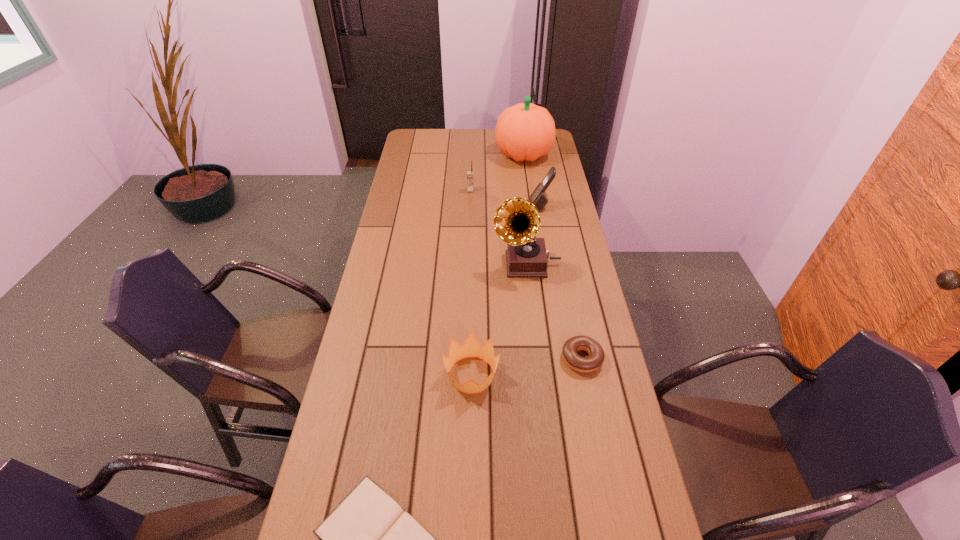
At what (x,y) coordinates should I click in order to perform the action: click on free space that is in between the taller cellular telephone and the crown. Please return your answer as a coordinate pair (x, y). The width and height of the screenshot is (960, 540). Looking at the image, I should click on (506, 291).

I want to click on vacant point located between the third farthest object and the doughnut, so click(561, 282).

I want to click on unoccupied area between the fifth tallest object and the phonograph record, so click(499, 319).

Identify which object is located as the fourth nearest to the nearest object. Please provide its 2D coordinates. Your answer should be formatted as a tuple, i.e. [(x, y)], where the tuple contains the x and y coordinates of a point satisfying the conditions above.

[(539, 198)]

At what (x,y) coordinates should I click in order to perform the action: click on object that stands as the second closest to the left cellular telephone. Please return your answer as a coordinate pair (x, y). Image resolution: width=960 pixels, height=540 pixels. Looking at the image, I should click on click(539, 198).

Locate an element on the screen. This screenshot has width=960, height=540. free space that satisfies the following two spatial constraints: 1. on the front-facing side of the doughnut; 2. on the right side of the fifth nearest object is located at coordinates (565, 359).

Where is `vacant space that satisfies the following two spatial constraints: 1. from the horn of the doughnut; 2. on the right side of the fourth nearest object`? vacant space that satisfies the following two spatial constraints: 1. from the horn of the doughnut; 2. on the right side of the fourth nearest object is located at coordinates (537, 359).

You are a GUI agent. You are given a task and a screenshot of the screen. Output one action in this format:
    pyautogui.click(x=<x>, y=<y>)
    Task: Click on the free point that satisfies the following two spatial constraints: 1. on the back side of the second shortest object; 2. on the front-facing side of the fifth nearest object
    
    Given the screenshot: What is the action you would take?
    pyautogui.click(x=551, y=206)

Where is `blank space that satisfies the following two spatial constraints: 1. on the front-facing side of the right cellular telephone; 2. on the back side of the doughnut`? The image size is (960, 540). blank space that satisfies the following two spatial constraints: 1. on the front-facing side of the right cellular telephone; 2. on the back side of the doughnut is located at coordinates (565, 359).

At what (x,y) coordinates should I click in order to perform the action: click on free space that satisfies the following two spatial constraints: 1. on the front of the shorter cellular telephone, where the keypad is located; 2. on the right side of the sixth tallest object. Please return your answer as a coordinate pair (x, y). Looking at the image, I should click on (466, 359).